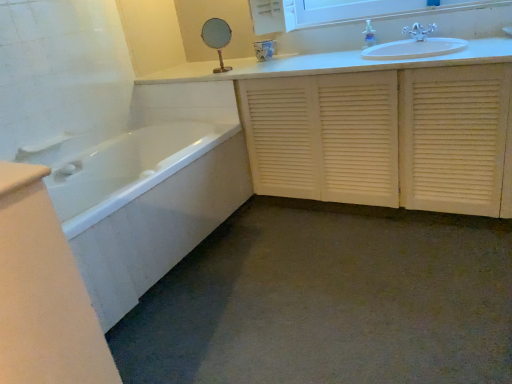
Identify the location of free spot behind silver metallic faucet at upper right. The width and height of the screenshot is (512, 384). (403, 36).